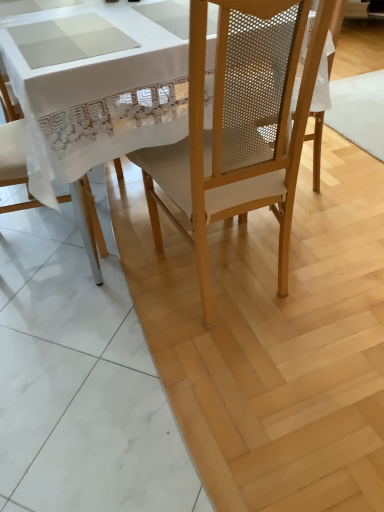
Where is `free space to the left of matte wood chair at center, the 1th chair when ordered from right to left`? free space to the left of matte wood chair at center, the 1th chair when ordered from right to left is located at coordinates pyautogui.click(x=117, y=287).